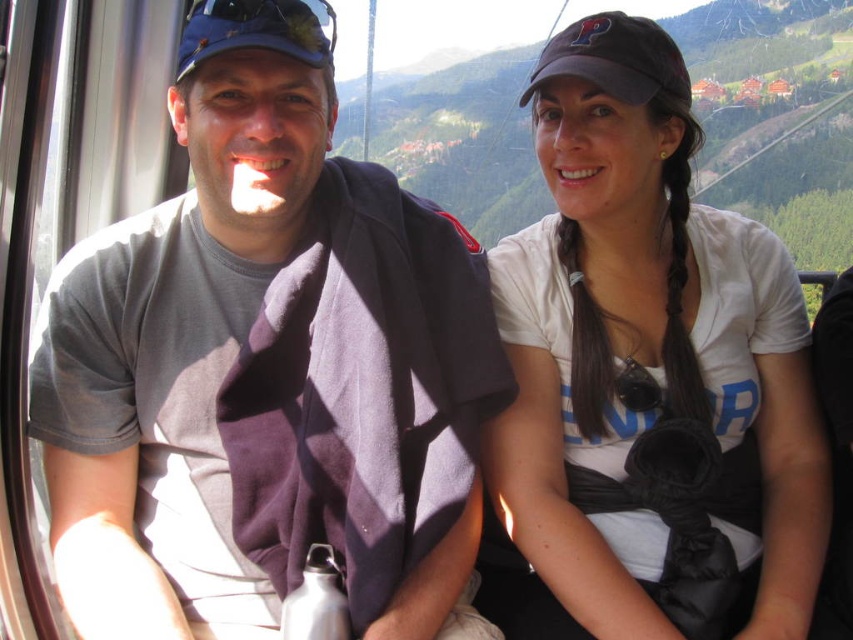
Question: Which of the following is the closest to the observer?

Choices:
 (A) white matte shirt at center
 (B) gray cotton t-shirt at center

Answer: (B)

Question: Among these points, which one is farthest from the camera?

Choices:
 (A) (596, 22)
 (B) (114, 524)
 (C) (782, 372)

Answer: (C)

Question: Does gray cotton t-shirt at center come behind dark gray fabric baseball cap at upper right?

Choices:
 (A) no
 (B) yes

Answer: (A)

Question: Can you confirm if white matte shirt at center is positioned above dark gray fabric baseball cap at upper right?

Choices:
 (A) yes
 (B) no

Answer: (B)

Question: Considering the relative positions of gray cotton t-shirt at center and dark gray fabric baseball cap at upper right in the image provided, where is gray cotton t-shirt at center located with respect to dark gray fabric baseball cap at upper right?

Choices:
 (A) above
 (B) below

Answer: (B)

Question: Which point is farther from the camera taking this photo?

Choices:
 (A) (459, 275)
 (B) (581, 19)
 (C) (538, 310)

Answer: (C)